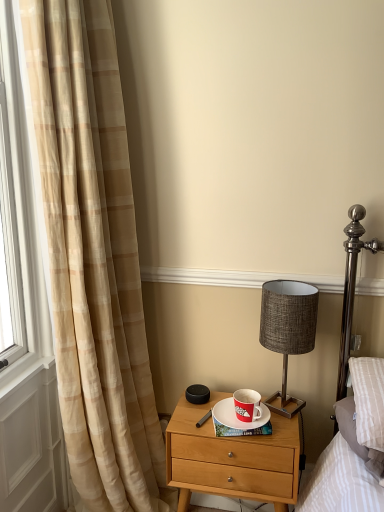
What are the coordinates of `vacant area to the right of red matte coffee cup at center` in the screenshot? It's located at (x=283, y=420).